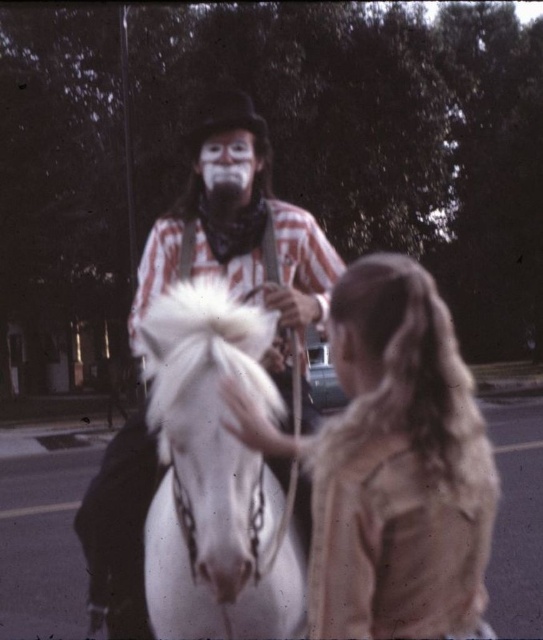
Question: Which point appears closest to the camera in this image?

Choices:
 (A) (470, 468)
 (B) (161, 275)

Answer: (A)

Question: Which object appears farthest from the camera in this image?

Choices:
 (A) matte striped shirt at center
 (B) white glossy horse at center

Answer: (A)

Question: Is light brown textured coat at center positioned before white glossy horse at center?

Choices:
 (A) no
 (B) yes

Answer: (B)

Question: Is light brown textured coat at center thinner than matte striped shirt at center?

Choices:
 (A) no
 (B) yes

Answer: (B)

Question: Estimate the real-world distances between objects in this image. Which object is closer to the light brown textured coat at center?

Choices:
 (A) matte striped shirt at center
 (B) white glossy horse at center

Answer: (B)

Question: Is light brown textured coat at center smaller than matte striped shirt at center?

Choices:
 (A) no
 (B) yes

Answer: (B)